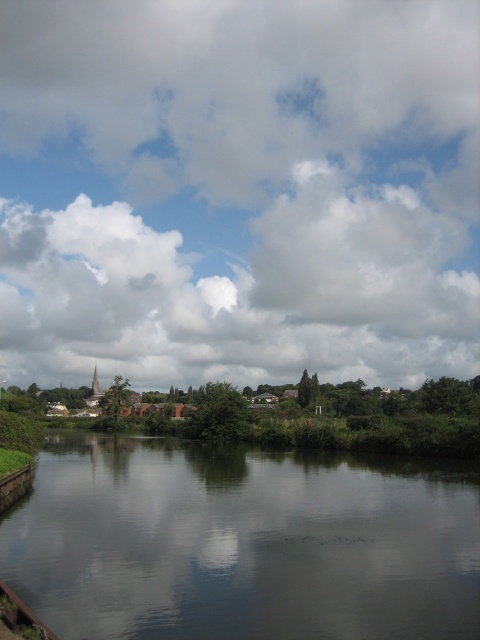
You are standing at the riverside and looking straight ahead. Which object, the cloudy sky at upper center or the smooth dark water at center, is located to the right of the other?

The cloudy sky at upper center is positioned on the right side of smooth dark water at center.

You are standing at the riverside and want to look up at the cloudy sky at upper center. Which direction should you look to see it?

The cloudy sky at upper center is located at point upper center, so you should look upwards in the center direction to see it.

You are standing at the riverside and looking straight ahead. Which object is positioned higher in the scene between the cloudy sky at upper center and the smooth dark water at center?

The cloudy sky at upper center is positioned higher than the smooth dark water at center in the scene.